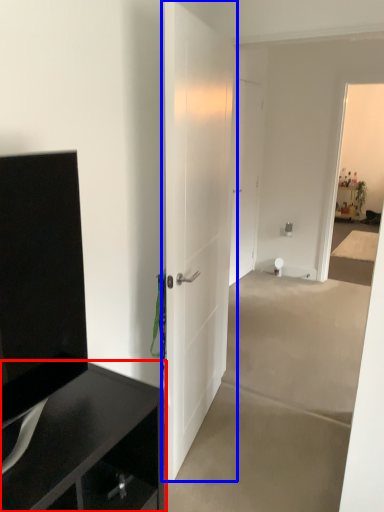
Question: Which object is further to the camera taking this photo, cabinetry (highlighted by a red box) or door (highlighted by a blue box)?

Choices:
 (A) cabinetry
 (B) door

Answer: (B)